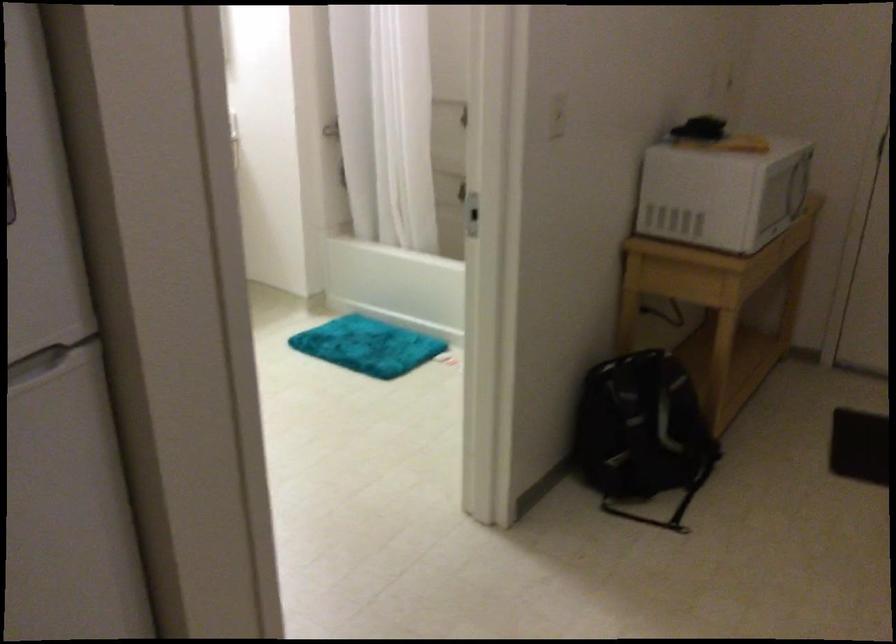
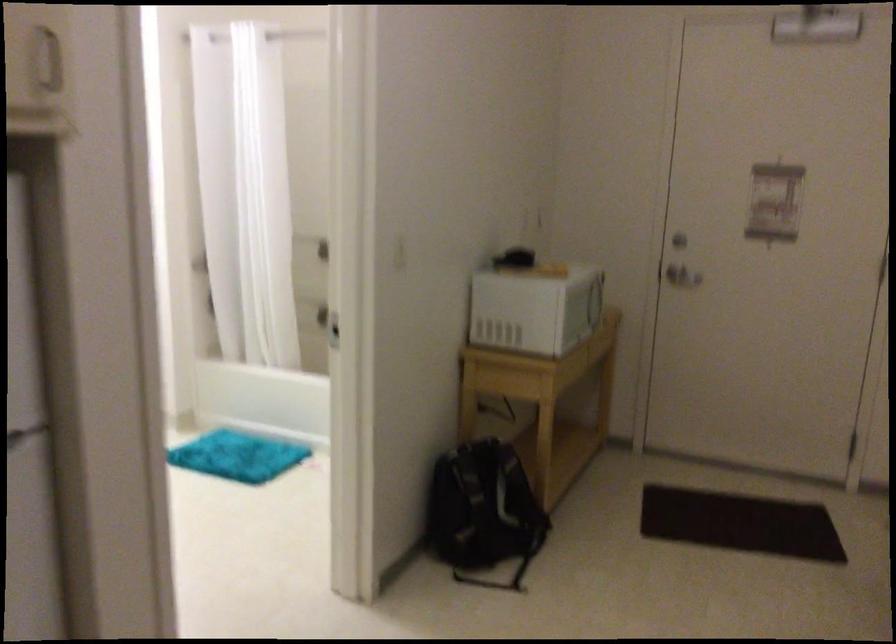
Find the pixel in the second image that matches (635,436) in the first image.

(483, 512)